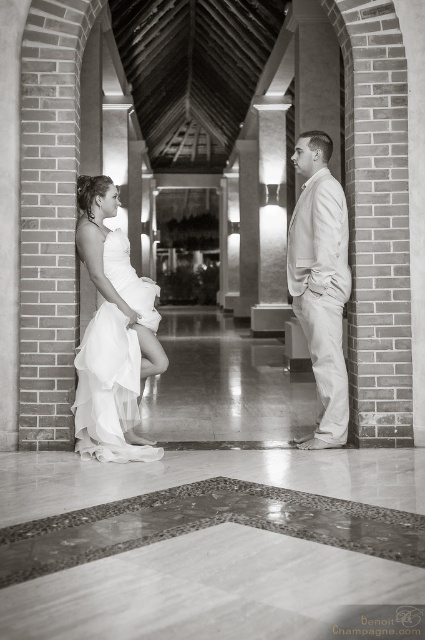
You are a photographer setting up equipment in the hallway. You need to place a 1.5 meter long extension pole between the white satin dress at left and the white tulle dress at center. Is there enough space for the pole?

The distance between the white satin dress at left and the white tulle dress at center is 1.29 meters. Since the pole is 1.5 meters long, it will not fit in the available space.

Based on the scene described, which object is positioned lower in the image? The white satin dress at left or the light beige suit at center?

The white satin dress at left is located below the light beige suit at center, so it is positioned lower in the image.

You are a photographer in the grand hallway and want to place a decorative archway exactly halfway between the light beige suit at center and the nearest arched brick column. What coordinate should you use for the archway?

The light beige suit at center is at point (320, 284). To place the archway halfway between it and the nearest arched brick column, you would need to calculate the midpoint between these two points. However, the exact coordinates of the nearest column aren